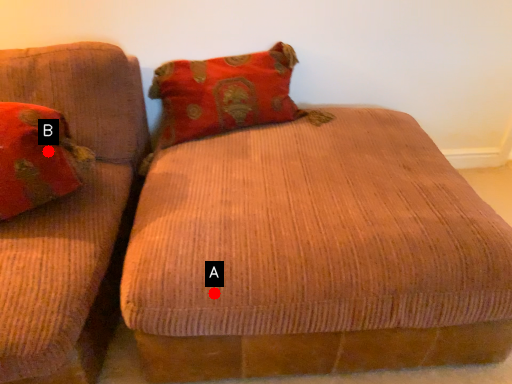
Question: Two points are circled on the image, labeled by A and B beside each circle. Among these points, which one is nearest to the camera?

Choices:
 (A) A is closer
 (B) B is closer

Answer: (A)